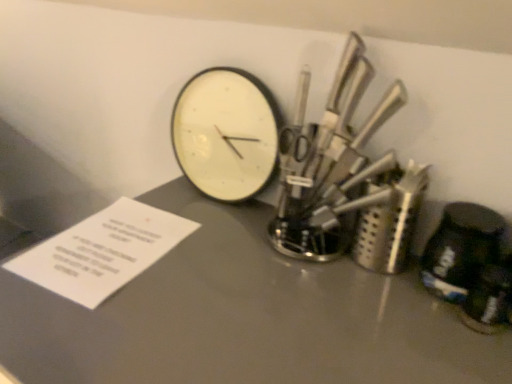
This screenshot has width=512, height=384. Identify the location of free spot above white paper at lower left (from a real-world perspective). (112, 244).